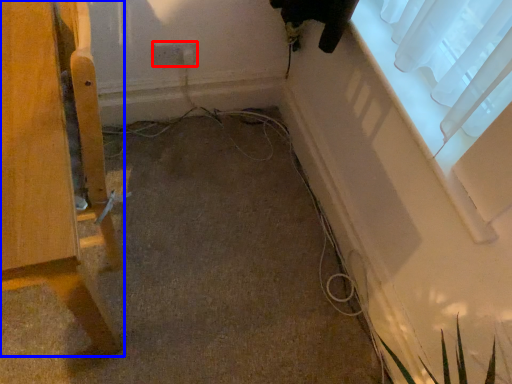
Question: Which object is closer to the camera taking this photo, electric outlet (highlighted by a red box) or furniture (highlighted by a blue box)?

Choices:
 (A) electric outlet
 (B) furniture

Answer: (B)